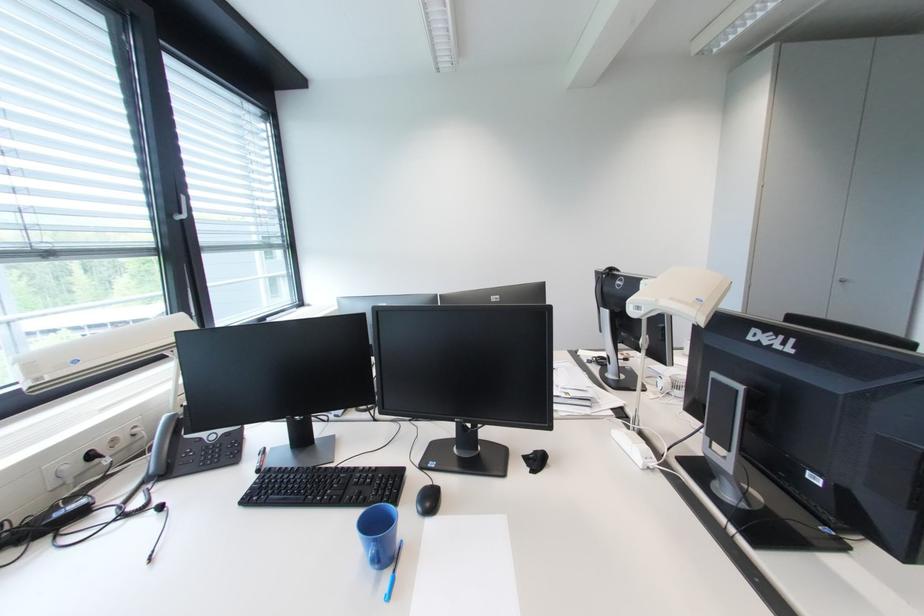
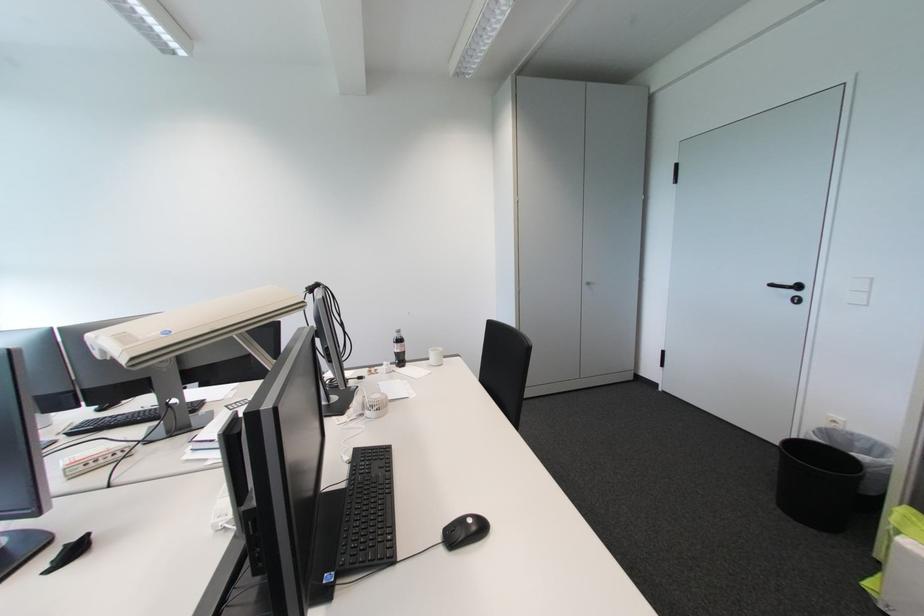
Question: In a continuous first-person perspective shot, in which direction is the camera moving?

Choices:
 (A) Left
 (B) Right
 (C) Forward
 (D) Backward

Answer: (B)